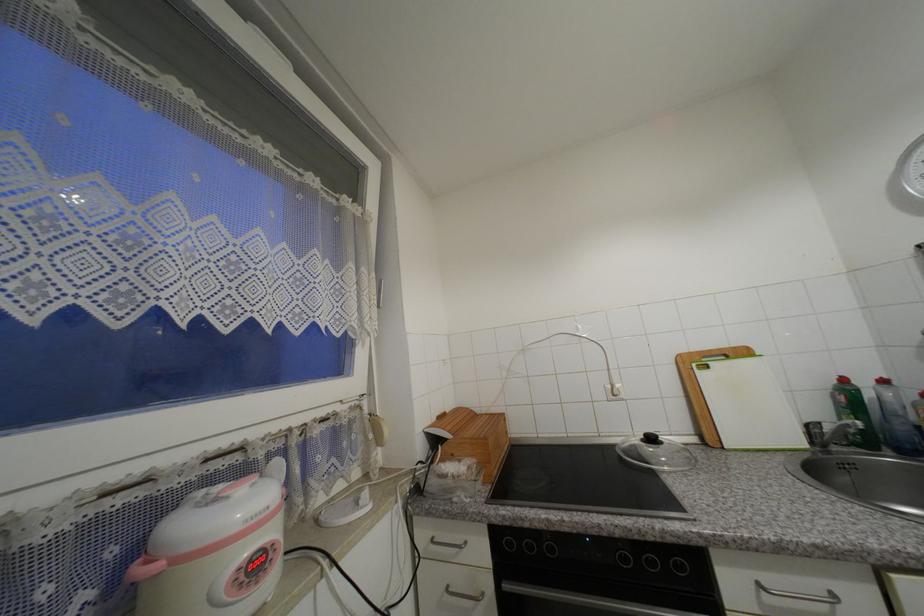
Find where to lift the pot lid handle. Please return your answer as a coordinate pair (x, y).

(276, 466)